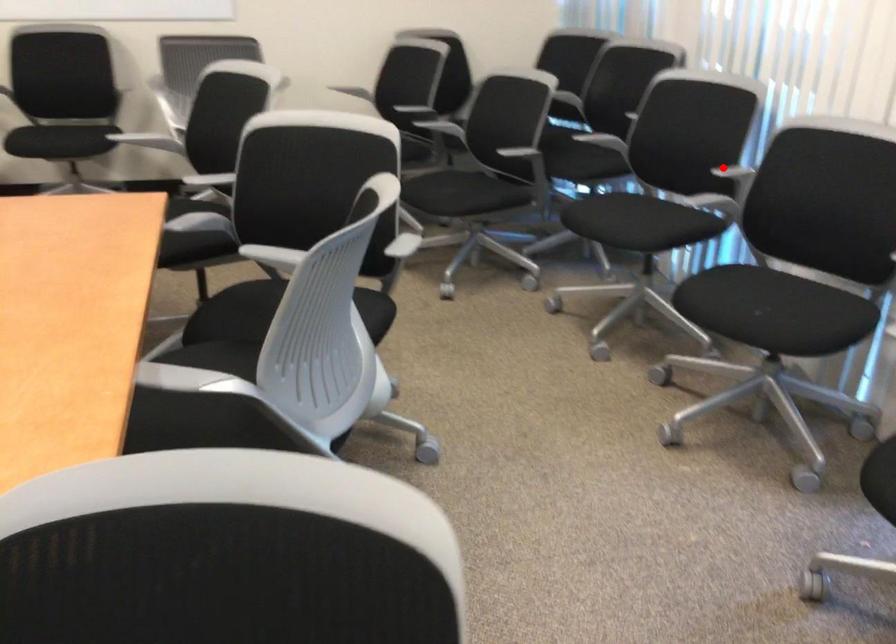
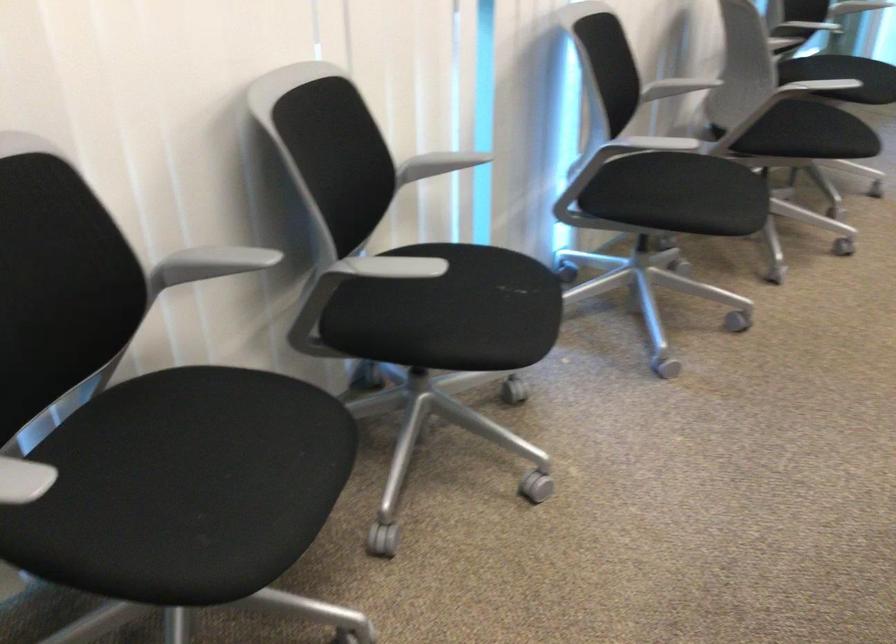
Question: I am providing you with two images of the same scene from different viewpoints. Given a red point in image1, look at the same physical point in image2. Is it:

Choices:
 (A) Closer to the viewpoint
 (B) Farther from the viewpoint

Answer: (A)